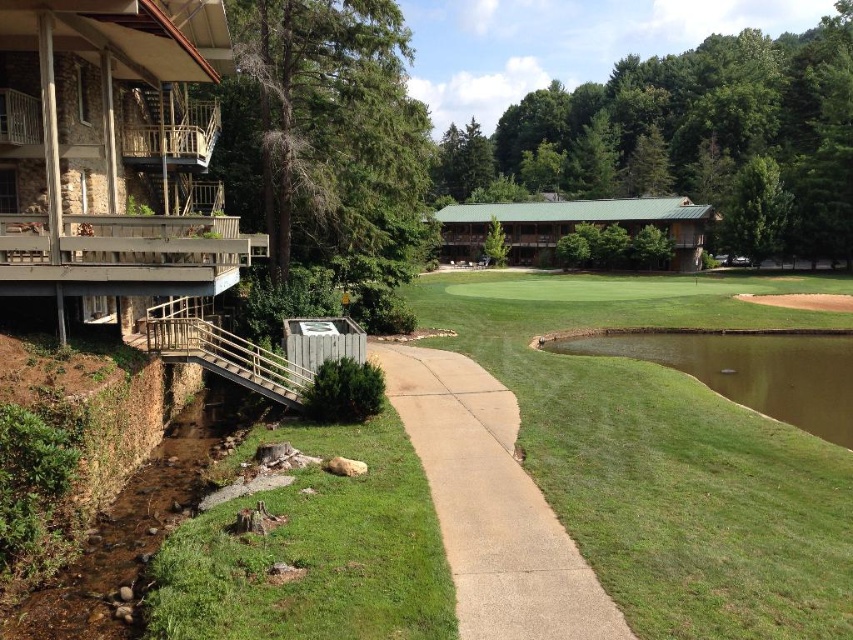
Is point (540, 291) positioned before point (612, 348)?

No, (540, 291) is further to viewer.

Who is higher up, green grassy golf course at center or green grassy water at right?

Positioned higher is green grassy golf course at center.

Who is more distant from viewer, (657, 548) or (740, 378)?

Positioned behind is point (740, 378).

The image size is (853, 640). I want to click on green grassy golf course at center, so click(666, 452).

Which is in front, point (509, 522) or point (744, 388)?

Point (509, 522) is in front.

Is gray concrete sidewalk at center to the right of green grassy water at right from the viewer's perspective?

Incorrect, gray concrete sidewalk at center is not on the right side of green grassy water at right.

Who is more distant from viewer, (457,586) or (840,360)?

Point (840,360)

Identify the location of gray concrete sidewalk at center. The image size is (853, 640). (491, 504).

Which is above, green grassy golf course at center or gray concrete sidewalk at center?

Positioned higher is green grassy golf course at center.

Where is `green grassy golf course at center`? This screenshot has width=853, height=640. green grassy golf course at center is located at coordinates (666, 452).

Which is in front, point (550, 497) or point (453, 392)?

Point (550, 497)

I want to click on green grassy golf course at center, so click(666, 452).